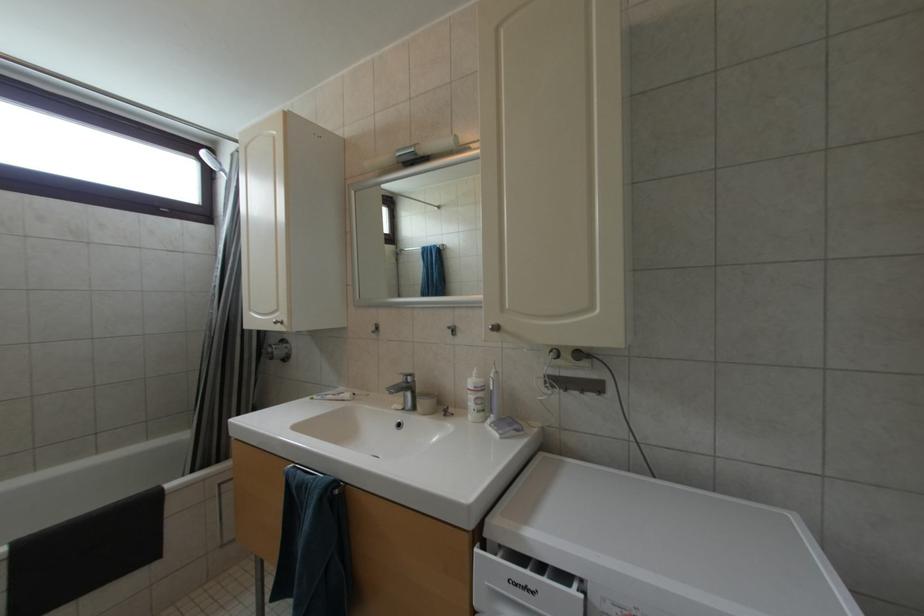
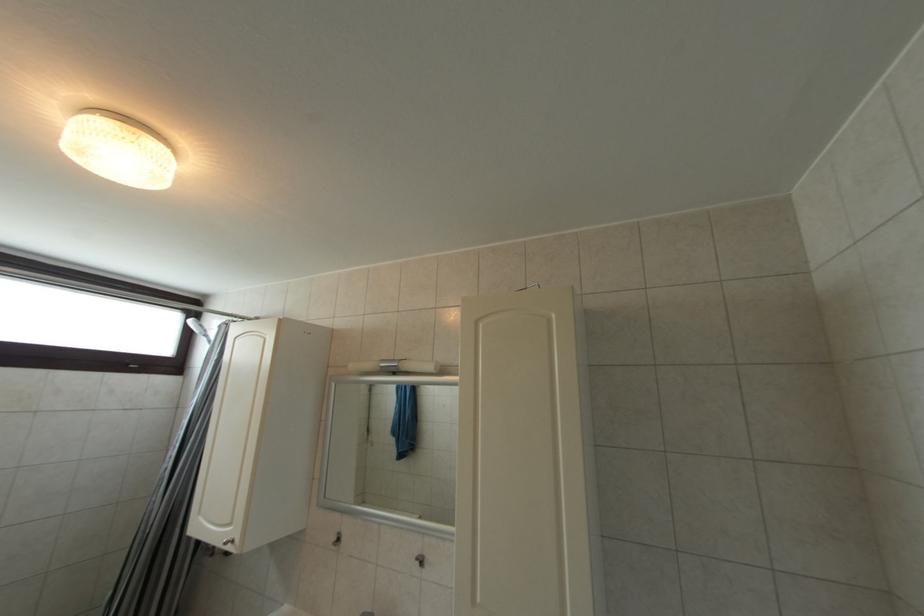
Question: In a continuous first-person perspective shot, in which direction is the camera moving?

Choices:
 (A) Left
 (B) Right
 (C) Forward
 (D) Backward

Answer: (D)